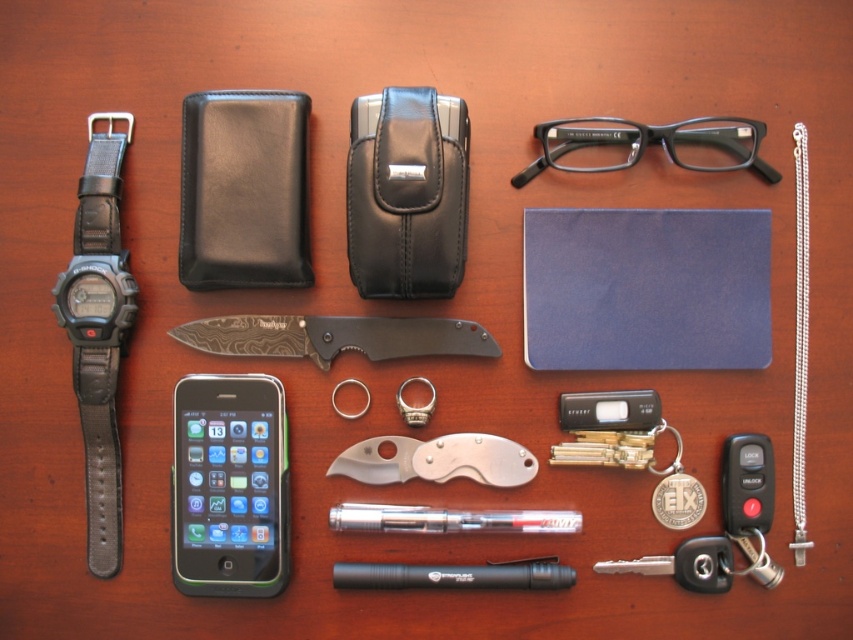
You are organizing a small display on a shelf and need to stack the silver metallic pocket knife at center and the silver chain necklace at right vertically. Which item should you place at the bottom to ensure stability?

You should place the silver metallic pocket knife at center at the bottom because it has a lesser height compared to the silver chain necklace at right, making it more stable.

You have a small box that can only fit items narrower than the green glossy smartphone at lower left. Can the black plastic pen at center fit into this box?

The green glossy smartphone at lower left has a lesser width compared to black plastic pen at center, so the pen is wider and cannot fit into the box.